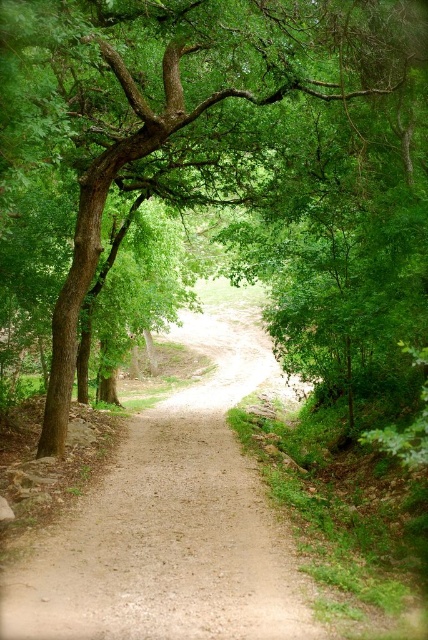
Can you confirm if green leafy tree at center is positioned above dirt path at center?

Yes, green leafy tree at center is above dirt path at center.

Can you confirm if green leafy tree at center is smaller than dirt path at center?

No.

Who is more forward, (55, 417) or (262, 632)?

Point (262, 632) is in front.

Where is `green leafy tree at center`? Image resolution: width=428 pixels, height=640 pixels. green leafy tree at center is located at coordinates (177, 106).